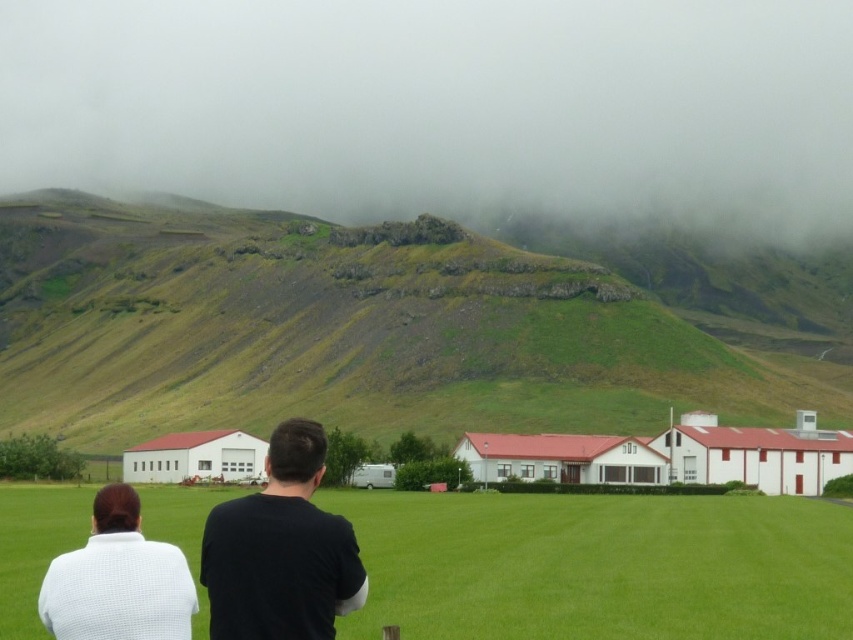
You are a hiker planning to walk from the white textured sweater at lower left to the foggy misty hillside at upper center. Given that your average walking speed is 5 km per hour, how many minutes will it take you to reach the hillside?

The distance between the white textured sweater at lower left and the foggy misty hillside at upper center is 477.42 meters. Converting meters to kilometers, that is 0.47742 km. Dividing this by your walking speed of 5 km per hour gives 0.095484 hours. Multiplying by 60 minutes, the total time is approximately 5.73 minutes. Therefore, it will take roughly 6 minutes to reach the hillside.

You are standing in the middle of the green grass field at lower center and want to walk to the black matte shirt at center. Which direction should you move to reach it?

The green grass field at lower center is positioned on the right side of the black matte shirt at center, so you should move to the left to reach it.

You are standing in the green grass field at lower center and want to walk towards the foggy misty hillside at upper center. In which direction should you head?

You should head to the left because the foggy misty hillside at upper center is located to the left of the green grass field at lower center.